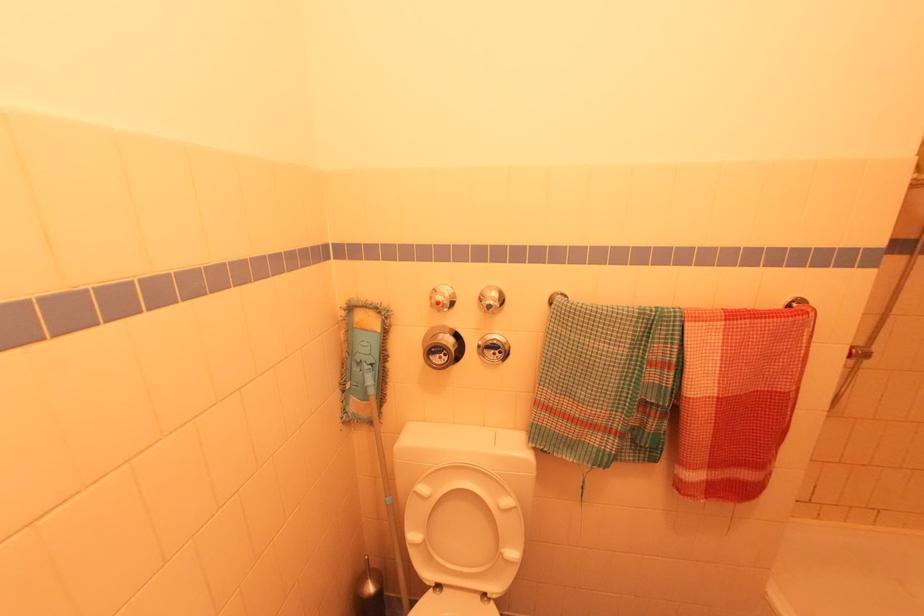
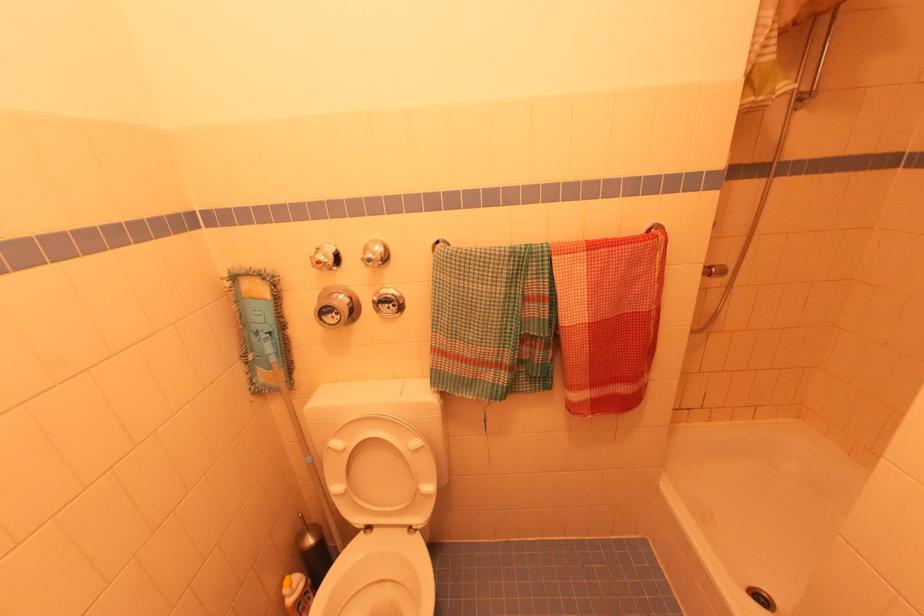
Locate, in the second image, the point that corresponds to [446,299] in the first image.

(327, 257)